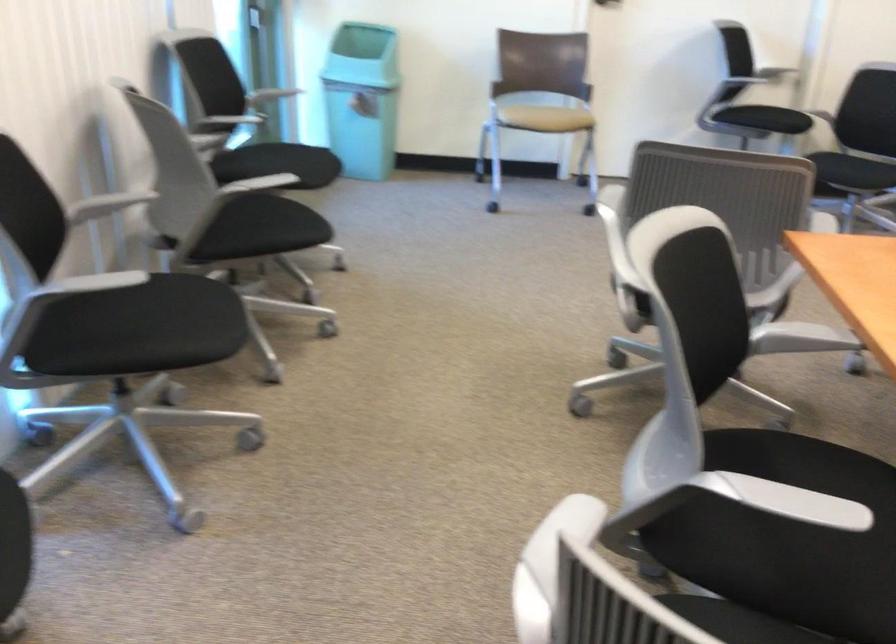
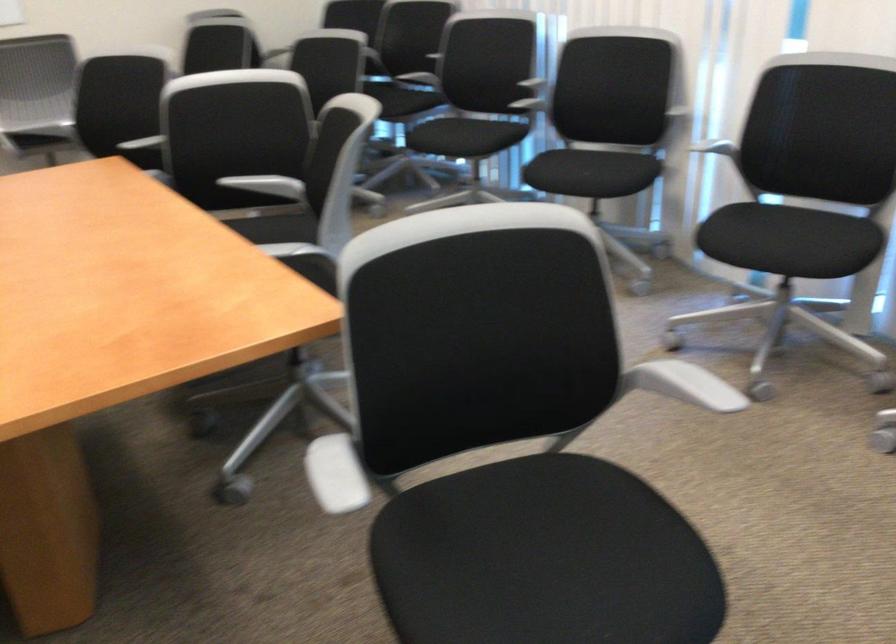
Locate, in the second image, the point that corresponds to pixel 690 493 in the first image.

(268, 185)